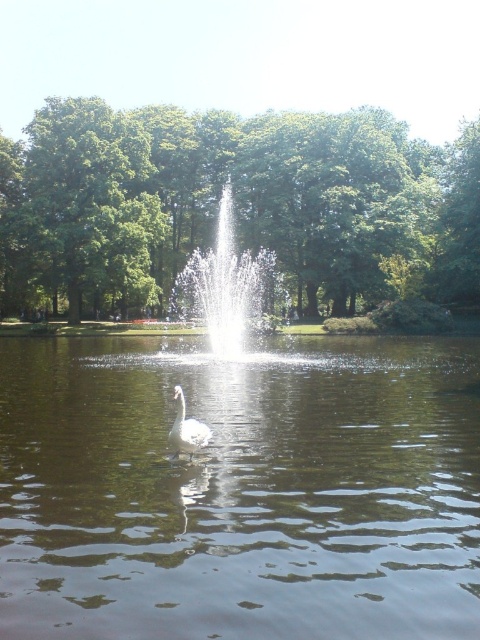
Question: Can you confirm if green leafy tree at center is smaller than white glossy swan at center?

Choices:
 (A) yes
 (B) no

Answer: (B)

Question: Which point is farther to the camera?

Choices:
 (A) (105, 294)
 (B) (33, 420)

Answer: (A)

Question: Based on their relative distances, which object is nearer to the green leafy tree at upper left?

Choices:
 (A) clear water at center
 (B) green leafy tree at center

Answer: (B)

Question: Is green leafy tree at upper left closer to the viewer compared to white glossy swan at center?

Choices:
 (A) no
 (B) yes

Answer: (A)

Question: Which of the following is the closest to the observer?

Choices:
 (A) clear water at center
 (B) white glossy swan at center
 (C) green leafy tree at center
 (D) green leafy tree at upper left

Answer: (A)

Question: Does green leafy tree at center appear on the left side of white glossy swan at center?

Choices:
 (A) yes
 (B) no

Answer: (B)